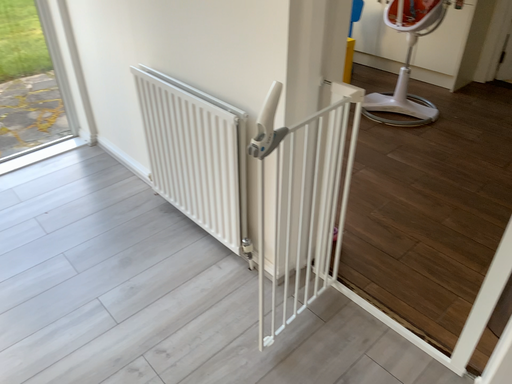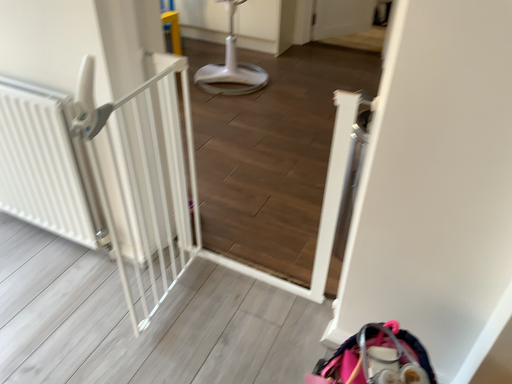
Question: Which way did the camera rotate in the video?

Choices:
 (A) rotated right
 (B) rotated left

Answer: (A)